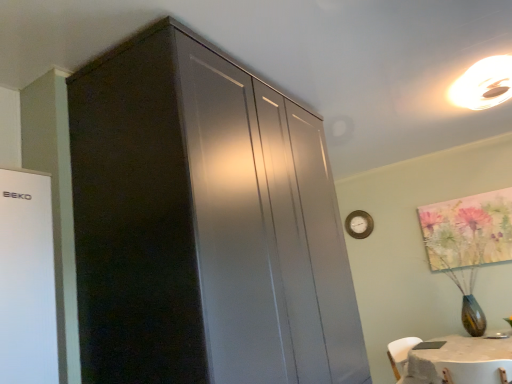
Question: Does matte black cabinet at upper left come behind wooden clock at upper right?

Choices:
 (A) yes
 (B) no

Answer: (B)

Question: Can you confirm if matte black cabinet at upper left is taller than wooden clock at upper right?

Choices:
 (A) yes
 (B) no

Answer: (A)

Question: From the image's perspective, is matte black cabinet at upper left on top of wooden clock at upper right?

Choices:
 (A) no
 (B) yes

Answer: (B)

Question: Is the surface of matte black cabinet at upper left in direct contact with wooden clock at upper right?

Choices:
 (A) yes
 (B) no

Answer: (B)

Question: Is matte black cabinet at upper left at the left side of wooden clock at upper right?

Choices:
 (A) yes
 (B) no

Answer: (A)

Question: Looking at the image, does watercolor floral painting at upper right seem bigger or smaller compared to matte white ceiling light at upper right?

Choices:
 (A) small
 (B) big

Answer: (B)

Question: Considering their positions, is watercolor floral painting at upper right located in front of or behind matte white ceiling light at upper right?

Choices:
 (A) behind
 (B) front

Answer: (A)

Question: From a real-world perspective, is watercolor floral painting at upper right positioned above or below matte white ceiling light at upper right?

Choices:
 (A) below
 (B) above

Answer: (A)

Question: Is point (423, 213) positioned closer to the camera than point (486, 107)?

Choices:
 (A) farther
 (B) closer

Answer: (A)

Question: Based on their positions, is wooden clock at upper right located to the left or right of matte black cabinet at upper left?

Choices:
 (A) left
 (B) right

Answer: (B)

Question: Is wooden clock at upper right inside the boundaries of matte black cabinet at upper left, or outside?

Choices:
 (A) inside
 (B) outside

Answer: (B)

Question: Is wooden clock at upper right in front of or behind matte black cabinet at upper left in the image?

Choices:
 (A) front
 (B) behind

Answer: (B)

Question: Considering the positions of wooden clock at upper right and matte black cabinet at upper left in the image, is wooden clock at upper right wider or thinner than matte black cabinet at upper left?

Choices:
 (A) thin
 (B) wide

Answer: (A)

Question: Choose the correct answer: Is wooden clock at upper right inside watercolor floral painting at upper right or outside it?

Choices:
 (A) inside
 (B) outside

Answer: (B)

Question: From a real-world perspective, relative to watercolor floral painting at upper right, is wooden clock at upper right vertically above or below?

Choices:
 (A) above
 (B) below

Answer: (A)